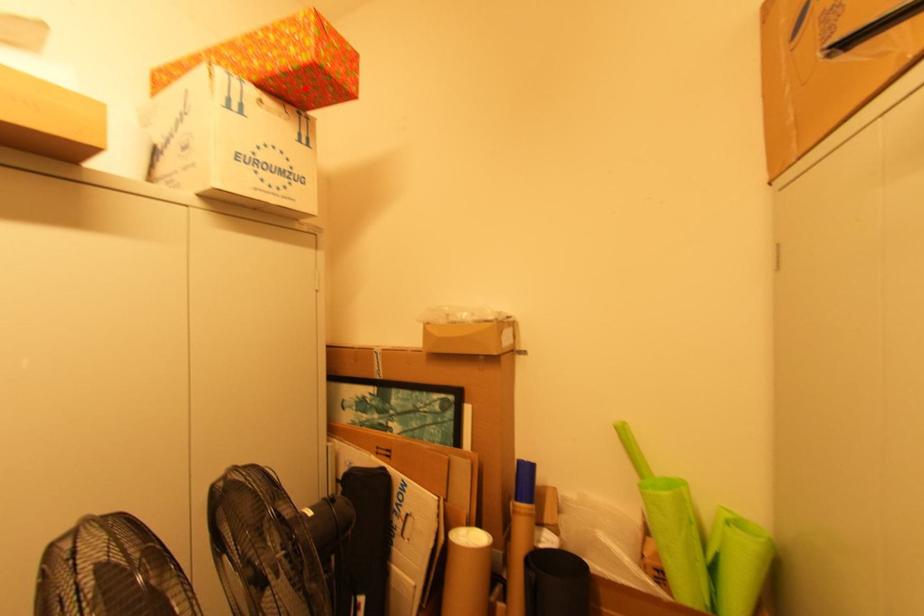
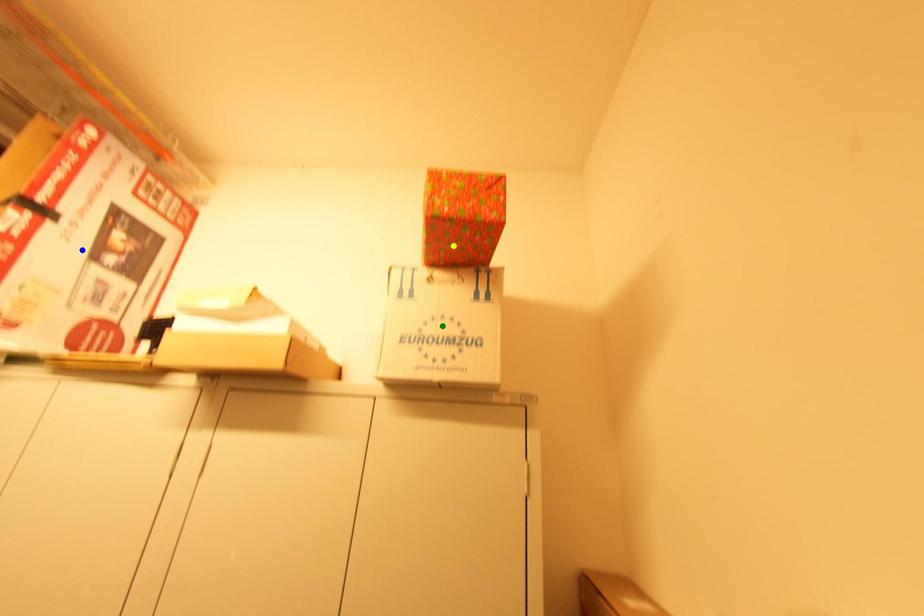
Question: I am providing you with two images of the same scene from different viewpoints. A red point is marked on the first image. You are given multiple points on the second image. Which point in image 2 represents the same 3d spot as the red point in image 1?

Choices:
 (A) blue point
 (B) yellow point
 (C) green point

Answer: (B)